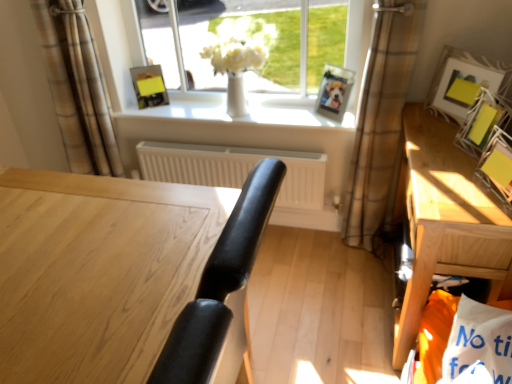
The height and width of the screenshot is (384, 512). What are the coordinates of `free space in front of brown plaid curtain at center right, which is the first curtain from right to left` in the screenshot? It's located at (354, 275).